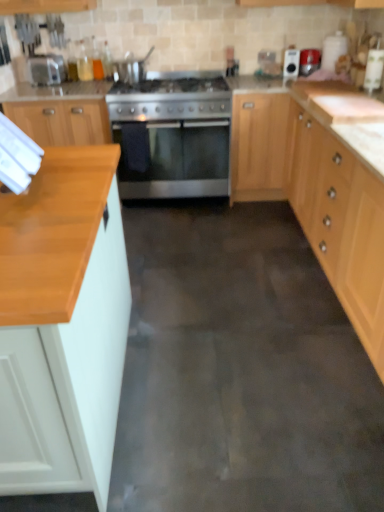
Question: Is stainless steel gas stove at center outside metallic red toaster at upper right, positioned as the 3th appliance in left-to-right order?

Choices:
 (A) yes
 (B) no

Answer: (A)

Question: Considering the relative sizes of stainless steel gas stove at center and metallic red toaster at upper right, the first appliance from the right, in the image provided, is stainless steel gas stove at center shorter than metallic red toaster at upper right, the first appliance from the right,?

Choices:
 (A) no
 (B) yes

Answer: (A)

Question: Considering the relative positions of stainless steel gas stove at center and metallic red toaster at upper right, the first appliance from the right, in the image provided, is stainless steel gas stove at center to the left of metallic red toaster at upper right, the first appliance from the right, from the viewer's perspective?

Choices:
 (A) no
 (B) yes

Answer: (B)

Question: From a real-world perspective, is stainless steel gas stove at center beneath metallic red toaster at upper right, positioned as the 3th appliance in left-to-right order?

Choices:
 (A) yes
 (B) no

Answer: (A)

Question: Is stainless steel gas stove at center with metallic red toaster at upper right, the first appliance from the right?

Choices:
 (A) no
 (B) yes

Answer: (A)

Question: Is metallic silver toaster at upper right, the 2th appliance when ordered from left to right, to the left or to the right of stainless steel oven at center in the image?

Choices:
 (A) left
 (B) right

Answer: (B)

Question: Is metallic silver toaster at upper right, the 2th appliance when ordered from left to right, situated inside stainless steel oven at center or outside?

Choices:
 (A) outside
 (B) inside

Answer: (A)

Question: Does point (296, 70) appear closer or farther from the camera than point (165, 180)?

Choices:
 (A) closer
 (B) farther

Answer: (B)

Question: Considering the positions of metallic silver toaster at upper right, the 2th appliance when ordered from left to right, and stainless steel oven at center in the image, is metallic silver toaster at upper right, the 2th appliance when ordered from left to right, wider or thinner than stainless steel oven at center?

Choices:
 (A) thin
 (B) wide

Answer: (A)

Question: Is metallic red toaster at upper right, positioned as the 3th appliance in left-to-right order, to the left or to the right of stainless steel gas stove at center in the image?

Choices:
 (A) left
 (B) right

Answer: (B)

Question: In terms of width, does metallic red toaster at upper right, the first appliance from the right, look wider or thinner when compared to stainless steel gas stove at center?

Choices:
 (A) wide
 (B) thin

Answer: (B)

Question: From the image's perspective, is metallic red toaster at upper right, positioned as the 3th appliance in left-to-right order, positioned above or below stainless steel gas stove at center?

Choices:
 (A) below
 (B) above

Answer: (B)

Question: Considering the positions of metallic red toaster at upper right, positioned as the 3th appliance in left-to-right order, and stainless steel gas stove at center in the image, is metallic red toaster at upper right, positioned as the 3th appliance in left-to-right order, bigger or smaller than stainless steel gas stove at center?

Choices:
 (A) big
 (B) small

Answer: (B)

Question: Is satin silver pot at upper center, which is counted as the 3th appliance, starting from the right, spatially inside metallic red toaster at upper right, positioned as the 3th appliance in left-to-right order, or outside of it?

Choices:
 (A) inside
 (B) outside

Answer: (B)

Question: In terms of width, does satin silver pot at upper center, which is counted as the 3th appliance, starting from the right, look wider or thinner when compared to metallic red toaster at upper right, the first appliance from the right?

Choices:
 (A) wide
 (B) thin

Answer: (A)